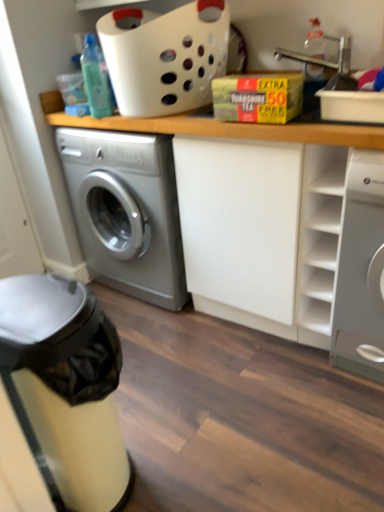
Question: Does matte silver dishwasher at lower left have a greater height compared to wooden counter at center?

Choices:
 (A) no
 (B) yes

Answer: (A)

Question: Does matte silver dishwasher at lower left have a larger size compared to wooden counter at center?

Choices:
 (A) no
 (B) yes

Answer: (A)

Question: Is the depth of matte silver dishwasher at lower left less than that of wooden counter at center?

Choices:
 (A) no
 (B) yes

Answer: (B)

Question: Considering the relative positions of matte silver dishwasher at lower left and wooden counter at center in the image provided, is matte silver dishwasher at lower left to the left of wooden counter at center from the viewer's perspective?

Choices:
 (A) no
 (B) yes

Answer: (B)

Question: Is matte silver dishwasher at lower left shorter than wooden counter at center?

Choices:
 (A) yes
 (B) no

Answer: (A)

Question: Is wooden counter at center completely or partially inside matte silver dishwasher at lower left?

Choices:
 (A) no
 (B) yes

Answer: (A)

Question: Can you confirm if white plastic basket at upper center is taller than wooden counter at center?

Choices:
 (A) yes
 (B) no

Answer: (B)

Question: From the image's perspective, does white plastic basket at upper center appear higher than wooden counter at center?

Choices:
 (A) no
 (B) yes

Answer: (B)

Question: Is white plastic basket at upper center directly adjacent to wooden counter at center?

Choices:
 (A) no
 (B) yes

Answer: (A)

Question: Can you confirm if white plastic basket at upper center is positioned to the left of wooden counter at center?

Choices:
 (A) no
 (B) yes

Answer: (B)

Question: Would you say wooden counter at center is part of white plastic basket at upper center's contents?

Choices:
 (A) no
 (B) yes

Answer: (A)

Question: Is white plastic basket at upper center closer to camera compared to wooden counter at center?

Choices:
 (A) yes
 (B) no

Answer: (B)

Question: Could you tell me if clear plastic bottle at upper right, the second bottle positioned from the left, is facing white glossy washing machine at right?

Choices:
 (A) yes
 (B) no

Answer: (B)